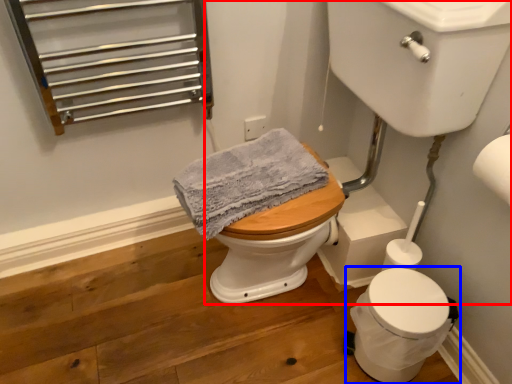
Question: Which object appears closest to the camera in this image, sink (highlighted by a red box) or toilet (highlighted by a blue box)?

Choices:
 (A) sink
 (B) toilet

Answer: (A)